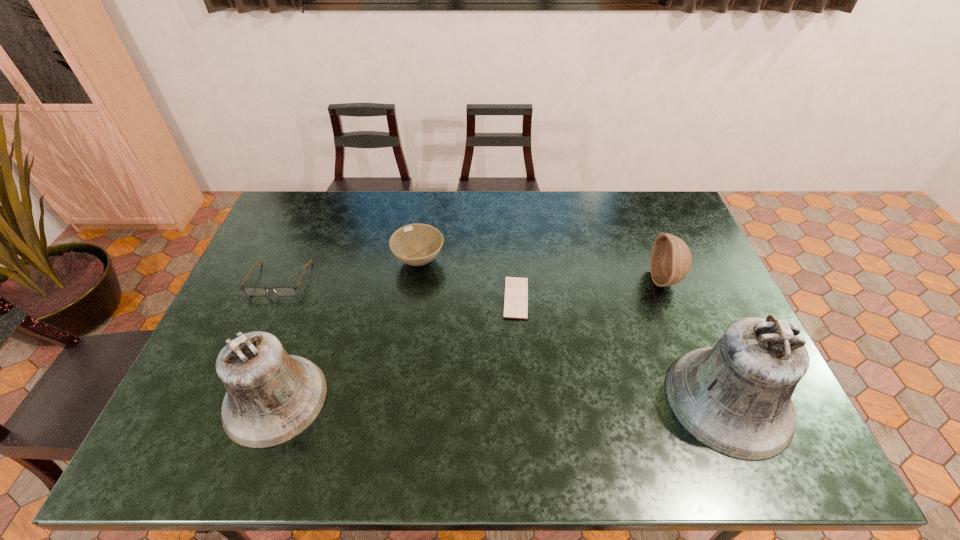
Find the location of a particular element. The width and height of the screenshot is (960, 540). location for an additional bell to make spacing equal is located at coordinates (501, 400).